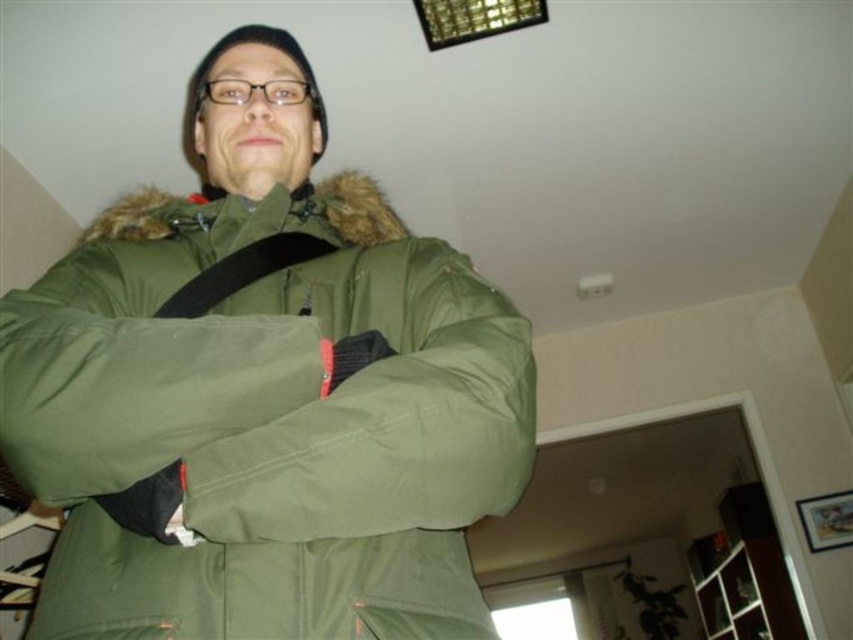
Question: Is the position of green matte jacket at center less distant than that of black fabric strap at center?

Choices:
 (A) yes
 (B) no

Answer: (A)

Question: Which object is farther from the camera taking this photo?

Choices:
 (A) black fabric strap at center
 (B) green matte jacket at center

Answer: (A)

Question: Does green matte jacket at center appear on the left side of black fabric strap at center?

Choices:
 (A) no
 (B) yes

Answer: (B)

Question: Does green matte jacket at center appear on the right side of black fabric strap at center?

Choices:
 (A) yes
 (B) no

Answer: (B)

Question: Among these points, which one is nearest to the camera?

Choices:
 (A) (209, 241)
 (B) (160, 307)

Answer: (B)